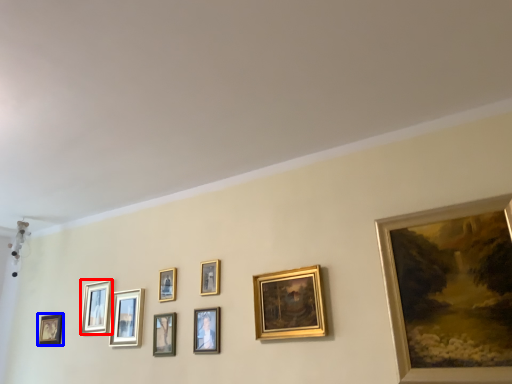
Question: Among these objects, which one is nearest to the camera, picture frame (highlighted by a red box) or picture frame (highlighted by a blue box)?

Choices:
 (A) picture frame
 (B) picture frame

Answer: (A)